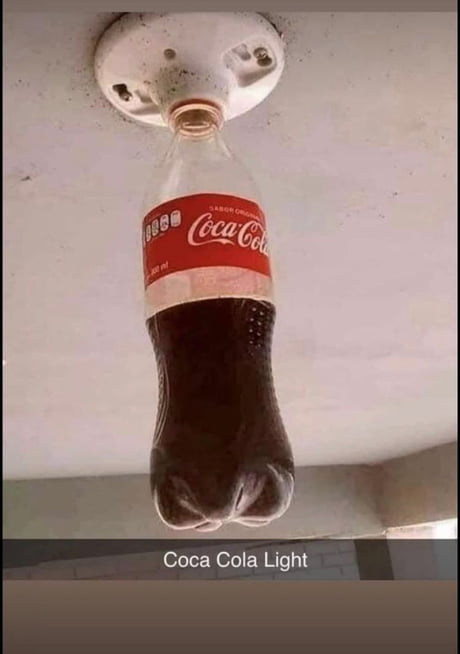
Identify the location of brick wall. The width and height of the screenshot is (460, 654). (329, 562).